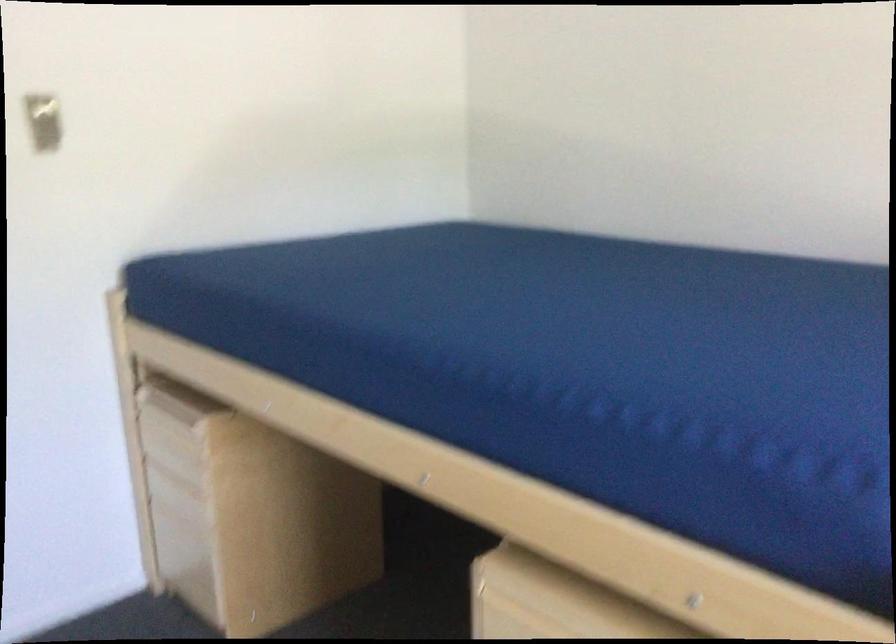
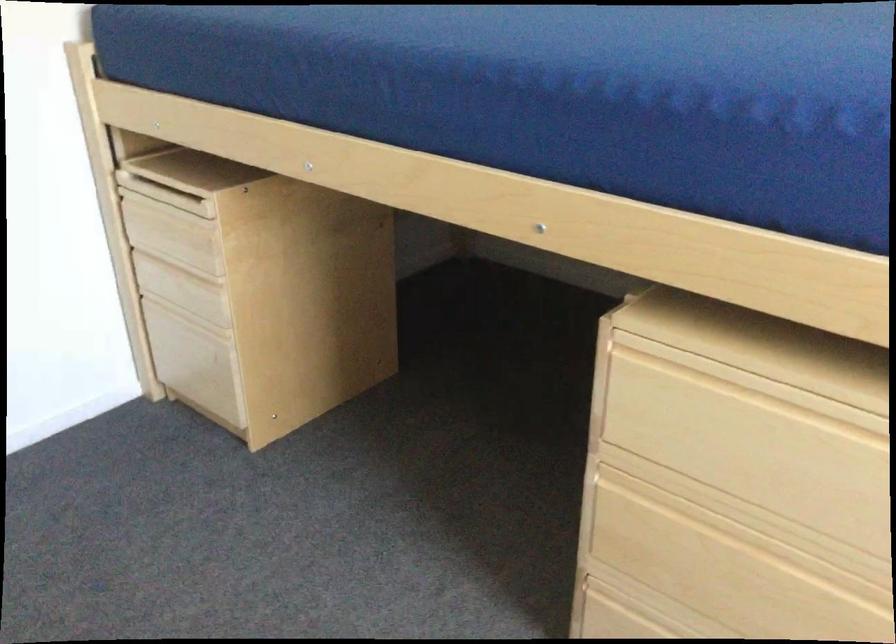
Question: The images are taken continuously from a first-person perspective. In which direction is your viewpoint rotating?

Choices:
 (A) Left
 (B) Right
 (C) Up
 (D) Down

Answer: (D)